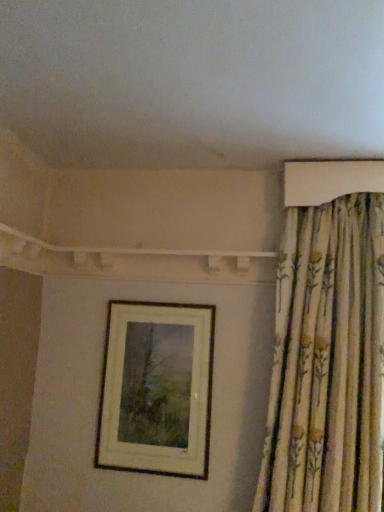
What do you see at coordinates (326, 362) in the screenshot?
I see `floral fabric curtain at upper right` at bounding box center [326, 362].

Where is `floral fabric curtain at upper right`? The height and width of the screenshot is (512, 384). floral fabric curtain at upper right is located at coordinates (326, 362).

What is the approximate height of wooden picture frame at center?

wooden picture frame at center is 73.75 centimeters tall.

Where is `wooden picture frame at center`? Image resolution: width=384 pixels, height=512 pixels. wooden picture frame at center is located at coordinates (157, 388).

Describe the element at coordinates (157, 388) in the screenshot. I see `wooden picture frame at center` at that location.

Measure the distance between wooden picture frame at center and camera.

The distance of wooden picture frame at center from camera is 5.82 feet.

The width and height of the screenshot is (384, 512). In order to click on floral fabric curtain at upper right in this screenshot , I will do `click(326, 362)`.

Is floral fabric curtain at upper right at the right side of wooden picture frame at center?

Yes.

Which object is more forward, floral fabric curtain at upper right or wooden picture frame at center?

floral fabric curtain at upper right is in front.

Does point (267, 479) come behind point (108, 452)?

No, it is not.

From the image's perspective, is floral fabric curtain at upper right above or below wooden picture frame at center?

floral fabric curtain at upper right is situated higher than wooden picture frame at center in the image.

From a real-world perspective, relative to wooden picture frame at center, is floral fabric curtain at upper right vertically above or below?

floral fabric curtain at upper right is situated higher than wooden picture frame at center in the real world.

Which of these two, floral fabric curtain at upper right or wooden picture frame at center, is wider?

Wider between the two is floral fabric curtain at upper right.

Considering the relative sizes of floral fabric curtain at upper right and wooden picture frame at center in the image provided, is floral fabric curtain at upper right taller than wooden picture frame at center?

Correct, floral fabric curtain at upper right is much taller as wooden picture frame at center.

Looking at the image, does floral fabric curtain at upper right seem bigger or smaller compared to wooden picture frame at center?

Clearly, floral fabric curtain at upper right is larger in size than wooden picture frame at center.

Is floral fabric curtain at upper right situated inside wooden picture frame at center or outside?

floral fabric curtain at upper right is not inside wooden picture frame at center, it's outside.

Are floral fabric curtain at upper right and wooden picture frame at center beside each other?

No, floral fabric curtain at upper right is not with wooden picture frame at center.

Is floral fabric curtain at upper right positioned with its back to wooden picture frame at center?

No, wooden picture frame at center is not at the back of floral fabric curtain at upper right.

How different are the orientations of floral fabric curtain at upper right and wooden picture frame at center in degrees?

floral fabric curtain at upper right and wooden picture frame at center are facing 0.00376 degrees away from each other.

Based on the photo, how distant is floral fabric curtain at upper right from wooden picture frame at center?

floral fabric curtain at upper right and wooden picture frame at center are 19.91 inches apart from each other.

The width and height of the screenshot is (384, 512). I want to click on picture frame on the left of the floral fabric curtain at upper right, so click(x=157, y=388).

Considering the positions of objects wooden picture frame at center and floral fabric curtain at upper right in the image provided, who is more to the left, wooden picture frame at center or floral fabric curtain at upper right?

From the viewer's perspective, wooden picture frame at center appears more on the left side.

Is wooden picture frame at center further to camera compared to floral fabric curtain at upper right?

Yes, it is.

Considering the points (203, 350) and (314, 228), which point is in front, point (203, 350) or point (314, 228)?

The point (314, 228) is more forward.

In the scene shown: From the image's perspective, which is below, wooden picture frame at center or floral fabric curtain at upper right?

wooden picture frame at center appears lower in the image.

From the picture: From a real-world perspective, does wooden picture frame at center sit lower than floral fabric curtain at upper right?

Correct, in the physical world, wooden picture frame at center is lower than floral fabric curtain at upper right.

Does wooden picture frame at center have a greater width compared to floral fabric curtain at upper right?

No.

Is wooden picture frame at center shorter than floral fabric curtain at upper right?

Correct, wooden picture frame at center is not as tall as floral fabric curtain at upper right.

Considering the relative sizes of wooden picture frame at center and floral fabric curtain at upper right in the image provided, is wooden picture frame at center smaller than floral fabric curtain at upper right?

Yes.

Is floral fabric curtain at upper right located within wooden picture frame at center?

That's incorrect, floral fabric curtain at upper right is not inside wooden picture frame at center.

Is there a large distance between wooden picture frame at center and floral fabric curtain at upper right?

No.

In the scene shown: Is wooden picture frame at center facing away from floral fabric curtain at upper right?

That's not correct — wooden picture frame at center is not looking away from floral fabric curtain at upper right.

Locate an element on the screen. This screenshot has height=512, width=384. curtain that appears above the wooden picture frame at center (from a real-world perspective) is located at coordinates (326, 362).

The image size is (384, 512). What are the coordinates of `picture frame behind the floral fabric curtain at upper right` in the screenshot? It's located at (157, 388).

At what (x,y) coordinates should I click in order to perform the action: click on curtain that appears in front of the wooden picture frame at center. Please return your answer as a coordinate pair (x, y). Image resolution: width=384 pixels, height=512 pixels. Looking at the image, I should click on (326, 362).